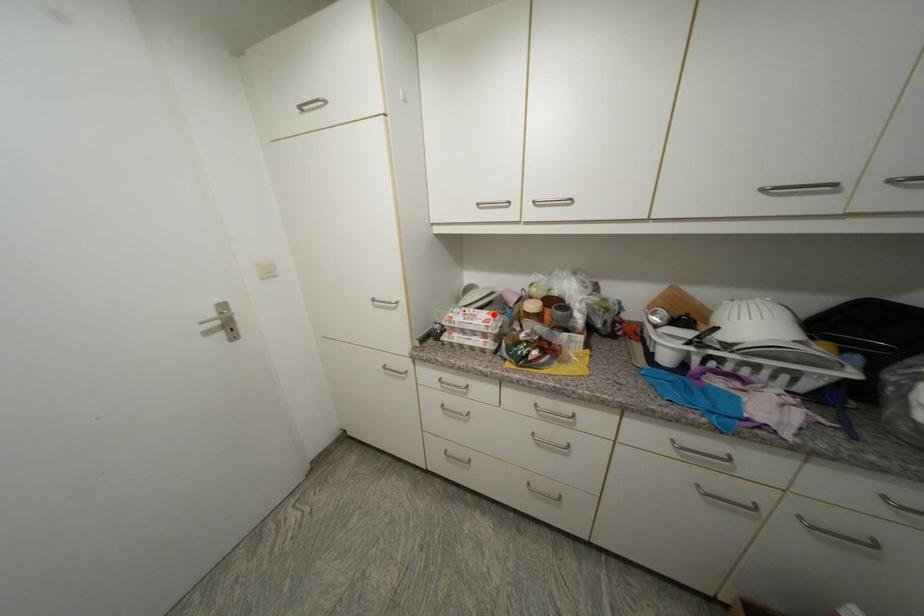
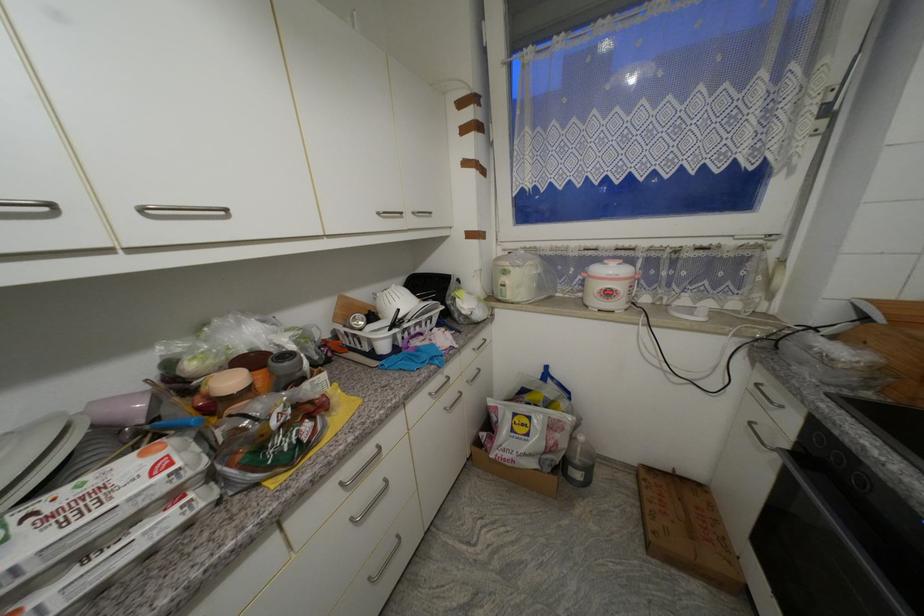
The point at the highlighted location is marked in the first image. Where is the corresponding point in the second image?

(149, 456)